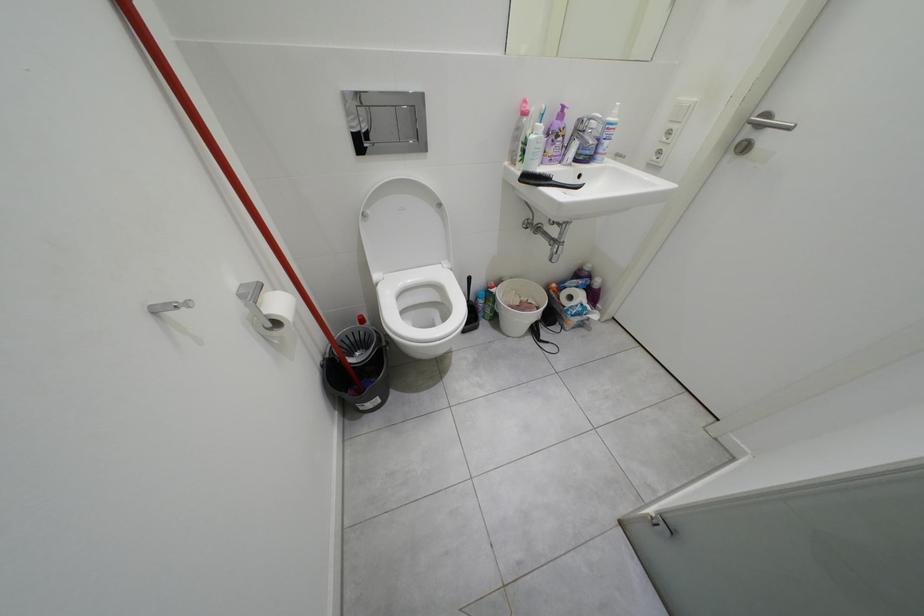
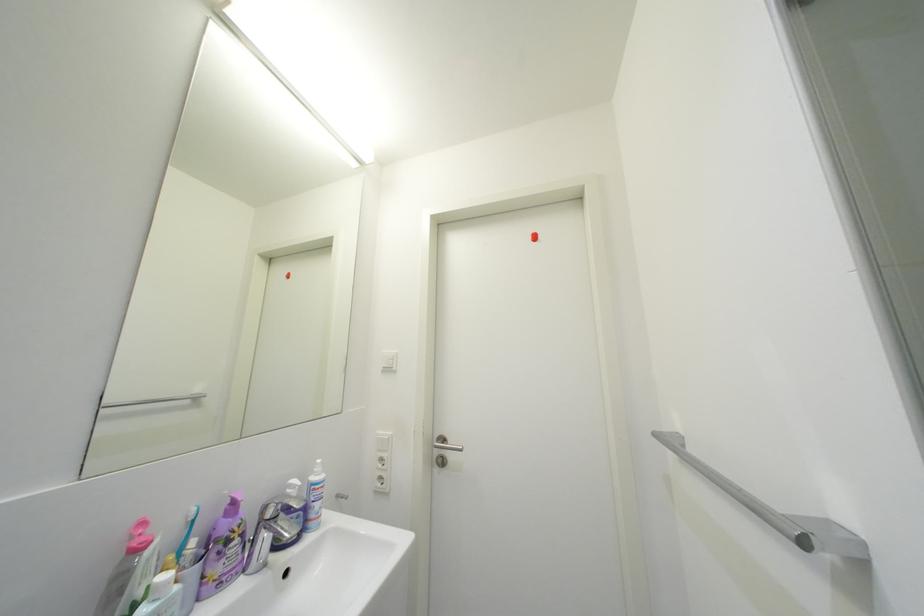
Consider the image. First-person continuous shooting, in which direction is the camera rotating?

The camera rotated toward right-up.